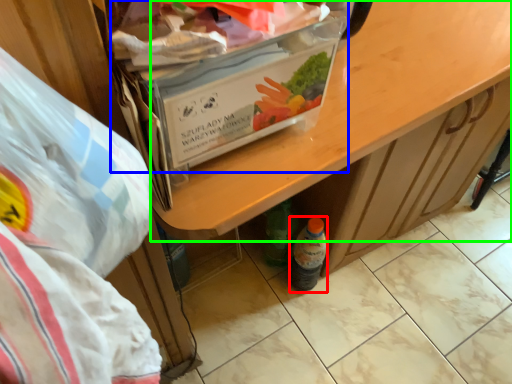
Question: Estimate the real-world distances between objects in this image. Which object is farther from bottle (highlighted by a red box), box (highlighted by a blue box) or desk (highlighted by a green box)?

Choices:
 (A) box
 (B) desk

Answer: (A)